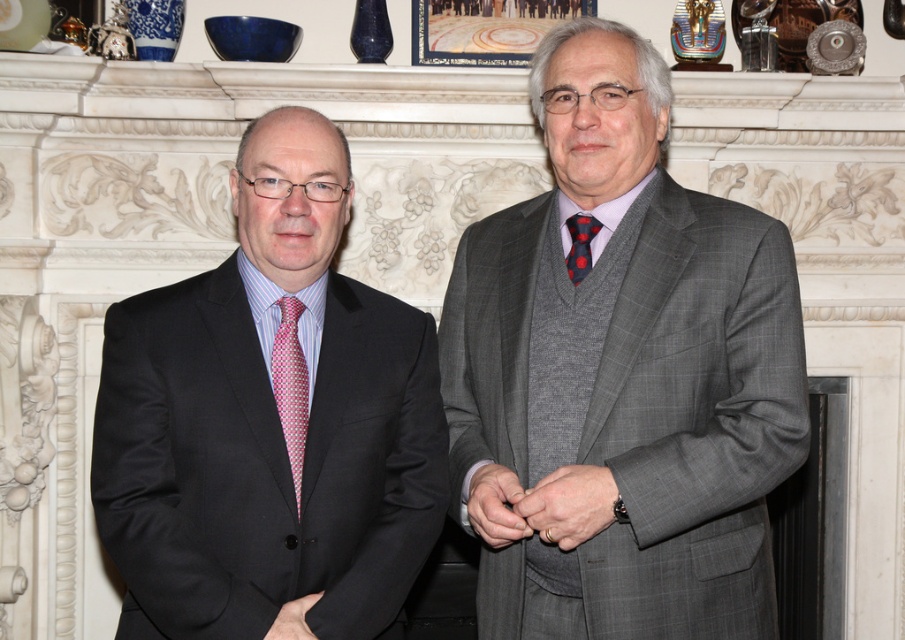
Does gray wool suit at center appear on the right side of matte black suit at center?

Correct, you'll find gray wool suit at center to the right of matte black suit at center.

Which is in front, point (653, 387) or point (318, 486)?

Point (318, 486) is more forward.

This screenshot has width=905, height=640. Find the location of `gray wool suit at center`. gray wool suit at center is located at coordinates (626, 368).

Does polka dot silk tie at center appear on the left side of matte black hand at center?

Incorrect, polka dot silk tie at center is not on the left side of matte black hand at center.

What do you see at coordinates (580, 244) in the screenshot?
I see `polka dot silk tie at center` at bounding box center [580, 244].

Is point (578, 244) positioned before point (306, 598)?

No.

I want to click on polka dot silk tie at center, so click(580, 244).

Who is more forward, (277, 388) or (576, 236)?

Point (277, 388) is more forward.

Is point (284, 422) positioned before point (575, 276)?

Yes.

The width and height of the screenshot is (905, 640). I want to click on pink dotted tie at left, so click(x=291, y=387).